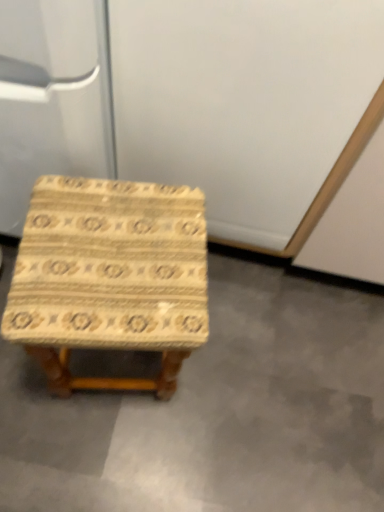
Identify the location of free space in front of wooden-patterned stool at center. Image resolution: width=384 pixels, height=512 pixels. 98,453.